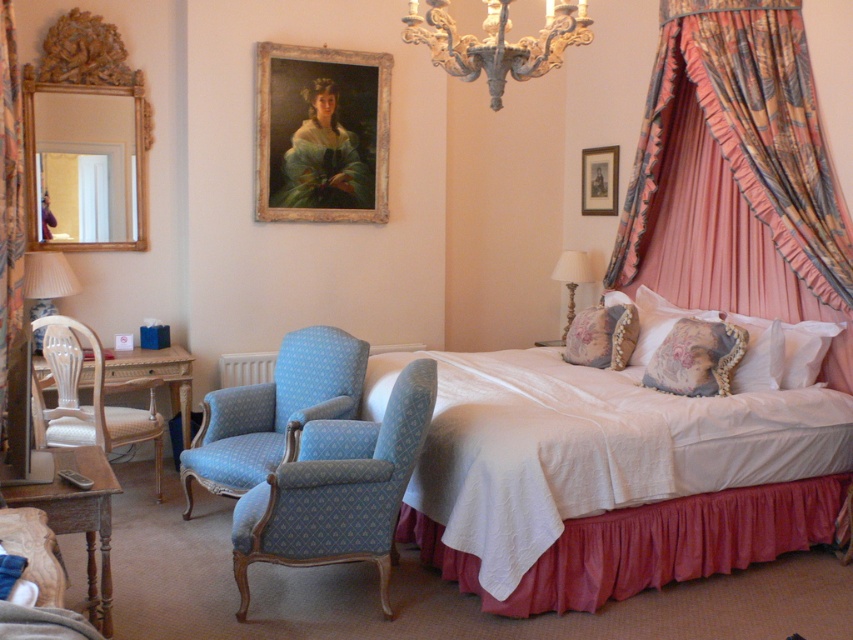
Can you confirm if gold-toned wood picture frame at upper center is smaller than antique brass chandelier at upper center?

No, gold-toned wood picture frame at upper center is not smaller than antique brass chandelier at upper center.

Based on the photo, does gold-toned wood picture frame at upper center have a larger size compared to antique brass chandelier at upper center?

Correct, gold-toned wood picture frame at upper center is larger in size than antique brass chandelier at upper center.

Between point (270, 157) and point (547, 4), which one is positioned in front?

Point (547, 4) is more forward.

Where is `gold-toned wood picture frame at upper center`? This screenshot has width=853, height=640. gold-toned wood picture frame at upper center is located at coordinates (321, 132).

Can you confirm if gold-toned wood picture frame at upper center is positioned below woven cane chair at left?

No, gold-toned wood picture frame at upper center is not below woven cane chair at left.

Does point (259, 99) come farther from viewer compared to point (68, 433)?

Yes, point (259, 99) is behind point (68, 433).

This screenshot has width=853, height=640. Identify the location of gold-toned wood picture frame at upper center. (321, 132).

Which of these two, gold-toned wood picture frame at upper center or wooden table at lower left, stands taller?

gold-toned wood picture frame at upper center

Is gold-toned wood picture frame at upper center positioned at the back of wooden table at lower left?

That is True.

Which is in front, point (277, 138) or point (83, 520)?

Positioned in front is point (83, 520).

You are a GUI agent. You are given a task and a screenshot of the screen. Output one action in this format:
    pyautogui.click(x=<x>, y=<y>)
    Task: Click on the gold-toned wood picture frame at upper center
    The image size is (853, 640).
    Given the screenshot: What is the action you would take?
    pyautogui.click(x=321, y=132)